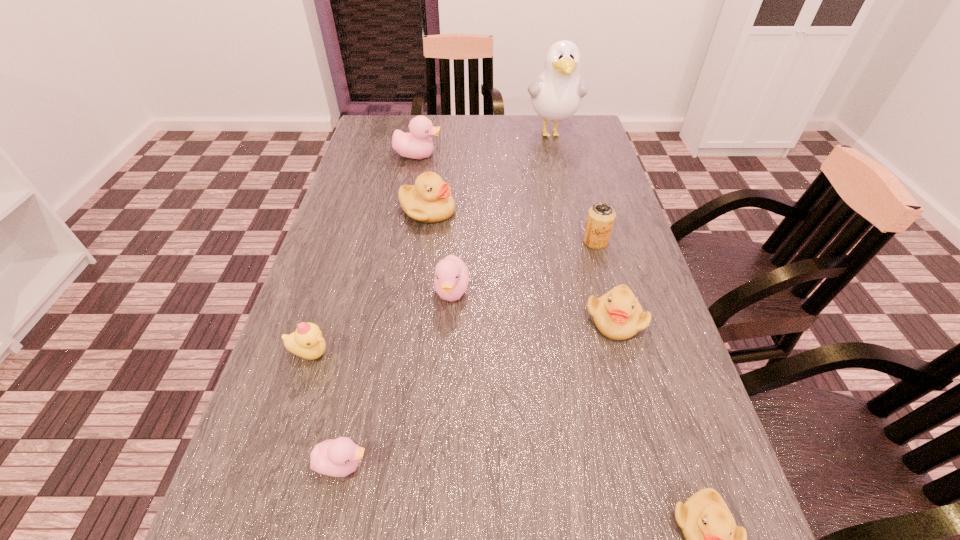
I want to click on duckling object that ranks as the second closest to the tallest object, so click(x=429, y=200).

Find the location of a particular element. Image resolution: width=960 pixels, height=540 pixels. pink duckling that stands as the closest to the tallest object is located at coordinates (417, 144).

At what (x,y) coordinates should I click in order to perform the action: click on pink duckling that stands as the second closest to the smallest yellow duckling. Please return your answer as a coordinate pair (x, y). The width and height of the screenshot is (960, 540). Looking at the image, I should click on 451,279.

Identify the location of yellow duckling that can be found as the third closest to the beer can. (713, 539).

I want to click on the closest yellow duckling to the farthest pink duckling, so click(429, 200).